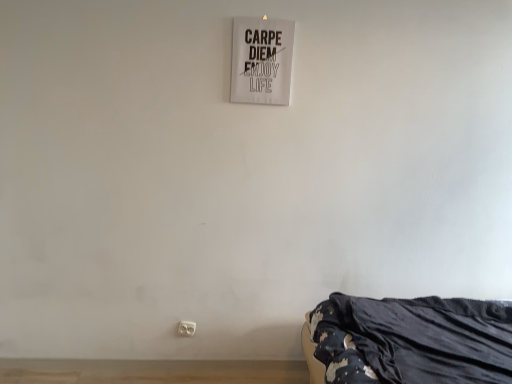
In order to face white paper sign at upper center, should I rotate leftwards or rightwards?

It's best to rotate right around 1.088 degrees.

This screenshot has height=384, width=512. I want to click on black fabric bed at lower right, so click(x=411, y=341).

Identify the location of white paper sign at upper center. This screenshot has width=512, height=384. (261, 61).

Is white plastic electric outlet at lower center located outside white paper sign at upper center?

Indeed, white plastic electric outlet at lower center is completely outside white paper sign at upper center.

Is white plastic electric outlet at lower center facing towards white paper sign at upper center?

No, white plastic electric outlet at lower center is not facing towards white paper sign at upper center.

From the image's perspective, who appears lower, white plastic electric outlet at lower center or white paper sign at upper center?

white plastic electric outlet at lower center.

Considering the relative sizes of white plastic electric outlet at lower center and white paper sign at upper center in the image provided, is white plastic electric outlet at lower center shorter than white paper sign at upper center?

Correct, white plastic electric outlet at lower center is not as tall as white paper sign at upper center.

Is white paper sign at upper center facing away from white plastic electric outlet at lower center?

No, white paper sign at upper center is not facing the opposite direction of white plastic electric outlet at lower center.

Considering the positions of point (234, 63) and point (178, 328), is point (234, 63) closer or farther from the camera than point (178, 328)?

Point (234, 63) appears to be closer to the viewer than point (178, 328).

Is white paper sign at upper center completely or partially outside of white plastic electric outlet at lower center?

That's correct, white paper sign at upper center is outside of white plastic electric outlet at lower center.

Based on the photo, which of these two, white paper sign at upper center or white plastic electric outlet at lower center, is bigger?

white paper sign at upper center.

Is point (401, 339) positioned before point (252, 94)?

Yes, it is.

From the image's perspective, which object appears higher, black fabric bed at lower right or white paper sign at upper center?

From the image's view, white paper sign at upper center is above.

Between black fabric bed at lower right and white paper sign at upper center, which one is positioned behind?

white paper sign at upper center is further from the camera.

Is black fabric bed at lower right shorter than white paper sign at upper center?

Yes, black fabric bed at lower right is shorter than white paper sign at upper center.

From the image's perspective, is black fabric bed at lower right positioned above or below white plastic electric outlet at lower center?

Clearly, from the image's perspective, black fabric bed at lower right is above white plastic electric outlet at lower center.

Is the depth of black fabric bed at lower right greater than that of white plastic electric outlet at lower center?

That is False.

Is black fabric bed at lower right wider or thinner than white plastic electric outlet at lower center?

Considering their sizes, black fabric bed at lower right looks broader than white plastic electric outlet at lower center.

Considering the sizes of objects white plastic electric outlet at lower center and black fabric bed at lower right in the image provided, who is bigger, white plastic electric outlet at lower center or black fabric bed at lower right?

black fabric bed at lower right is bigger.

At what (x,y) coordinates should I click in order to perform the action: click on furniture in front of the white plastic electric outlet at lower center. Please return your answer as a coordinate pair (x, y). Image resolution: width=512 pixels, height=384 pixels. Looking at the image, I should click on (411, 341).

Is white plastic electric outlet at lower center further to camera compared to black fabric bed at lower right?

Yes.

From a real-world perspective, is white plastic electric outlet at lower center physically above black fabric bed at lower right?

No, from a real-world perspective, white plastic electric outlet at lower center is not over black fabric bed at lower right

Which object is positioned more to the right, white paper sign at upper center or black fabric bed at lower right?

black fabric bed at lower right is more to the right.

Can you confirm if white paper sign at upper center is wider than black fabric bed at lower right?

No, white paper sign at upper center is not wider than black fabric bed at lower right.

How many degrees apart are the facing directions of white paper sign at upper center and black fabric bed at lower right?

The facing directions of white paper sign at upper center and black fabric bed at lower right are 88.4 degrees apart.

Can you confirm if white paper sign at upper center is smaller than black fabric bed at lower right?

Yes.

This screenshot has width=512, height=384. I want to click on electric outlet on the left of the white paper sign at upper center, so click(x=186, y=328).

The height and width of the screenshot is (384, 512). Identify the location of electric outlet behind the white paper sign at upper center. pos(186,328).

When comparing their distances from white plastic electric outlet at lower center, does black fabric bed at lower right or white paper sign at upper center seem further?

white paper sign at upper center lies further to white plastic electric outlet at lower center than the other object.

In the scene shown: Estimate the real-world distances between objects in this image. Which object is closer to white paper sign at upper center, black fabric bed at lower right or white plastic electric outlet at lower center?

black fabric bed at lower right is positioned closer to the anchor white paper sign at upper center.

Which object lies nearer to the anchor point black fabric bed at lower right, white plastic electric outlet at lower center or white paper sign at upper center?

white plastic electric outlet at lower center lies closer to black fabric bed at lower right than the other object.

When comparing their distances from white plastic electric outlet at lower center, does white paper sign at upper center or black fabric bed at lower right seem further?

Based on the image, white paper sign at upper center appears to be further to white plastic electric outlet at lower center.

From the image, which object appears to be farther from black fabric bed at lower right, white paper sign at upper center or white plastic electric outlet at lower center?

white paper sign at upper center is positioned further to the anchor black fabric bed at lower right.

Considering their positions, is white plastic electric outlet at lower center positioned closer to white paper sign at upper center than black fabric bed at lower right?

black fabric bed at lower right.

The image size is (512, 384). I want to click on furniture that lies between white paper sign at upper center and white plastic electric outlet at lower center from top to bottom, so click(x=411, y=341).